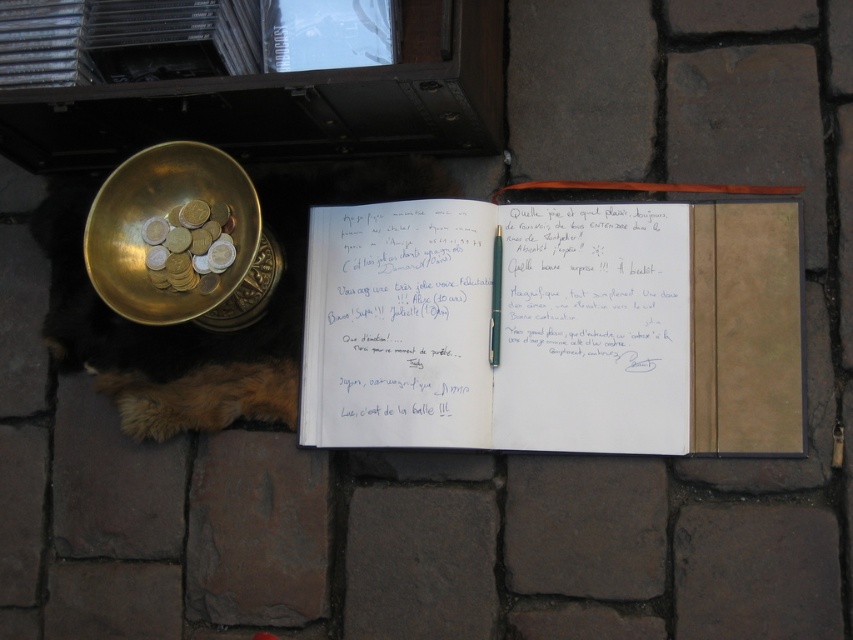
Who is higher up, gold metallic bowl at upper left or metallic silver pen at center?

gold metallic bowl at upper left is above.

Does gold metallic bowl at upper left have a lesser width compared to metallic silver pen at center?

Incorrect, gold metallic bowl at upper left's width is not less than metallic silver pen at center's.

Where is `gold metallic bowl at upper left`? The height and width of the screenshot is (640, 853). gold metallic bowl at upper left is located at coordinates (180, 240).

Does white paper notebook at center have a greater width compared to gold metallic bowl at upper left?

Yes, white paper notebook at center is wider than gold metallic bowl at upper left.

Can you confirm if white paper notebook at center is positioned to the right of gold metallic bowl at upper left?

Correct, you'll find white paper notebook at center to the right of gold metallic bowl at upper left.

Image resolution: width=853 pixels, height=640 pixels. I want to click on white paper notebook at center, so (555, 326).

Does gold metallic coins at left have a smaller size compared to metallic silver pen at center?

No, gold metallic coins at left is not smaller than metallic silver pen at center.

Between gold metallic coins at left and metallic silver pen at center, which one appears on the left side from the viewer's perspective?

Positioned to the left is gold metallic coins at left.

Is point (215, 220) closer to camera compared to point (502, 246)?

That is True.

At what (x,y) coordinates should I click in order to perform the action: click on gold metallic coins at left. Please return your answer as a coordinate pair (x, y). The image size is (853, 640). Looking at the image, I should click on point(189,244).